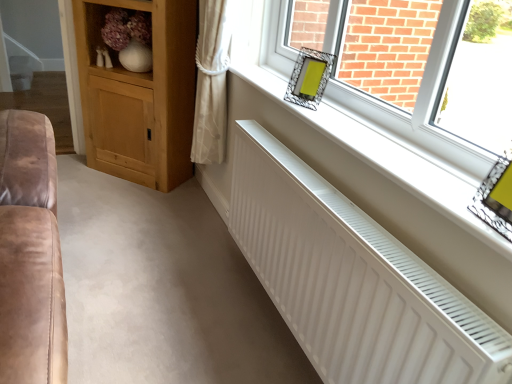
Question: Is there a large distance between metallic silver frame at upper right, marked as the first picture frame in a bottom-to-top arrangement, and white matte radiator at lower center?

Choices:
 (A) no
 (B) yes

Answer: (A)

Question: Is metallic silver frame at upper right, which is counted as the first picture frame, starting from the front, to the right of white matte radiator at lower center from the viewer's perspective?

Choices:
 (A) yes
 (B) no

Answer: (A)

Question: Is metallic silver frame at upper right, marked as the first picture frame in a bottom-to-top arrangement, taller than white matte radiator at lower center?

Choices:
 (A) yes
 (B) no

Answer: (A)

Question: From the image's perspective, does metallic silver frame at upper right, which is counted as the first picture frame, starting from the front, appear lower than white matte radiator at lower center?

Choices:
 (A) yes
 (B) no

Answer: (A)

Question: From the image's perspective, is metallic silver frame at upper right, arranged as the second picture frame when viewed from the top, above white matte radiator at lower center?

Choices:
 (A) no
 (B) yes

Answer: (A)

Question: Based on their positions, is metallic silver picture frame at upper right, which ranks as the 1th picture frame in left-to-right order, located to the left or right of white matte radiator at lower center?

Choices:
 (A) left
 (B) right

Answer: (A)

Question: From a real-world perspective, is metallic silver picture frame at upper right, marked as the 1th picture frame in a back-to-front arrangement, positioned above or below white matte radiator at lower center?

Choices:
 (A) above
 (B) below

Answer: (A)

Question: In the image, is metallic silver picture frame at upper right, the second picture frame when ordered from right to left, positioned in front of or behind white matte radiator at lower center?

Choices:
 (A) behind
 (B) front

Answer: (A)

Question: In terms of size, does metallic silver picture frame at upper right, which ranks as the 1th picture frame in left-to-right order, appear bigger or smaller than white matte radiator at lower center?

Choices:
 (A) big
 (B) small

Answer: (B)

Question: Do you think wooden shelf at upper left is within white ribbed radiator at lower center, or outside of it?

Choices:
 (A) outside
 (B) inside

Answer: (A)

Question: Looking at the image, does wooden shelf at upper left seem bigger or smaller compared to white ribbed radiator at lower center?

Choices:
 (A) big
 (B) small

Answer: (B)

Question: Considering the relative positions of wooden shelf at upper left and white ribbed radiator at lower center in the image provided, is wooden shelf at upper left to the left or to the right of white ribbed radiator at lower center?

Choices:
 (A) left
 (B) right

Answer: (A)

Question: In the image, is wooden shelf at upper left positioned in front of or behind white ribbed radiator at lower center?

Choices:
 (A) behind
 (B) front

Answer: (A)

Question: From a real-world perspective, is metallic silver frame at upper right, which is counted as the first picture frame, starting from the front, physically located above or below wooden shelf at upper left?

Choices:
 (A) below
 (B) above

Answer: (B)

Question: Looking at their shapes, would you say metallic silver frame at upper right, which is counted as the first picture frame, starting from the front, is wider or thinner than wooden shelf at upper left?

Choices:
 (A) wide
 (B) thin

Answer: (B)